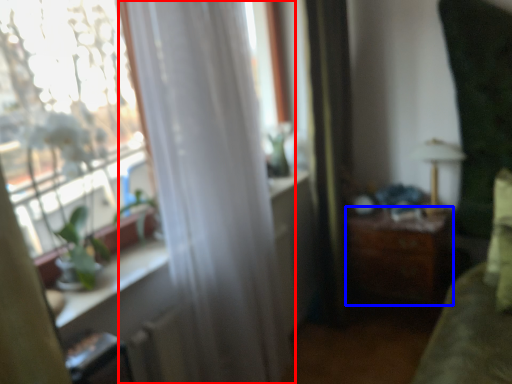
Question: Among these objects, which one is nearest to the camera, curtain (highlighted by a red box) or table (highlighted by a blue box)?

Choices:
 (A) curtain
 (B) table

Answer: (A)